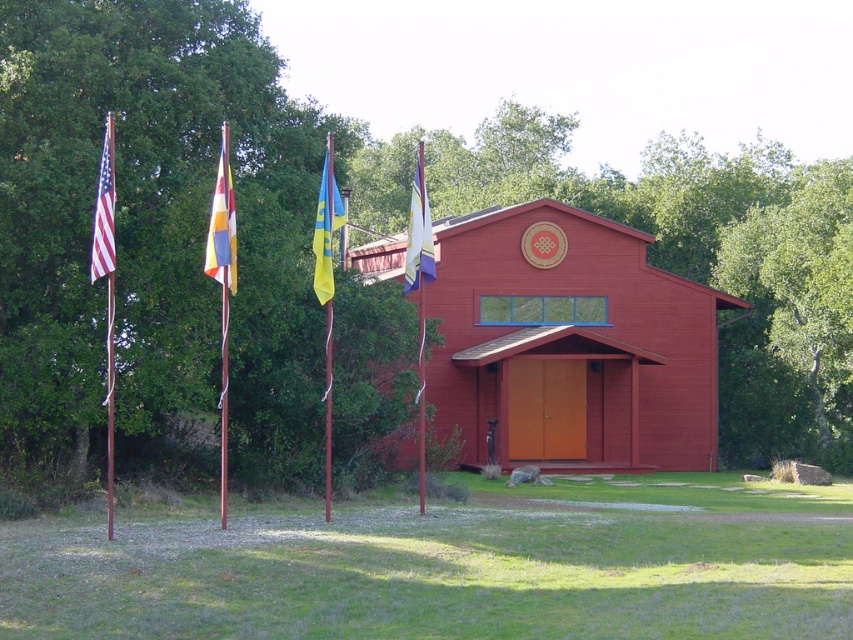
Question: Which point is closer to the camera taking this photo?

Choices:
 (A) [x=645, y=314]
 (B) [x=103, y=164]

Answer: (B)

Question: Which point is farther to the camera?

Choices:
 (A) multi-colored fabric flag at center
 (B) yellow fabric flag at center
 (C) silky blue flag at center
 (D) green leafy tree at left

Answer: (C)

Question: Does green leafy tree at left appear on the left side of silky blue flag at center?

Choices:
 (A) yes
 (B) no

Answer: (A)

Question: Can you confirm if matte red chapel at center is positioned below multi-colored fabric flag at center?

Choices:
 (A) yes
 (B) no

Answer: (A)

Question: Which point is farther to the camera?

Choices:
 (A) (213, 236)
 (B) (413, 285)

Answer: (B)

Question: Is yellow fabric flag at center wider than american flag at left?

Choices:
 (A) no
 (B) yes

Answer: (A)